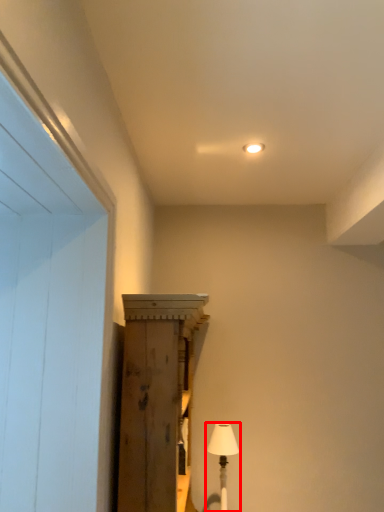
Question: From the image's perspective, what is the correct spatial relationship of table lamp (annotated by the red box) in relation to cabinetry?

Choices:
 (A) above
 (B) below

Answer: (B)